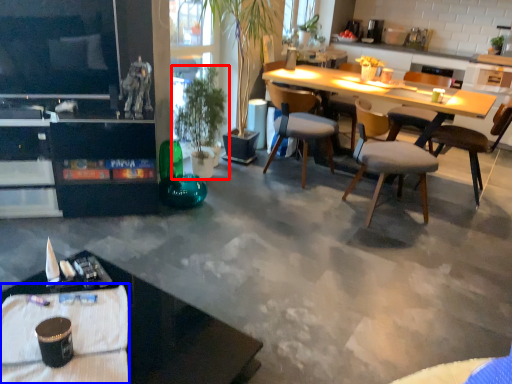
Question: Which object is further to the camera taking this photo, houseplant (highlighted by a red box) or tablecloth (highlighted by a blue box)?

Choices:
 (A) houseplant
 (B) tablecloth

Answer: (A)